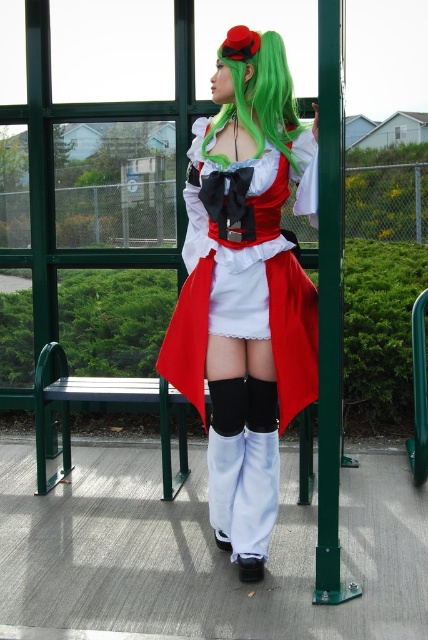
Question: Does satin red coat at center appear on the left side of green silky wig at center?

Choices:
 (A) yes
 (B) no

Answer: (A)

Question: Estimate the real-world distances between objects in this image. Which object is farther from the green silky wig at center?

Choices:
 (A) green metal bench at left
 (B) satin red coat at center

Answer: (A)

Question: Does green metal bench at left have a lesser width compared to green silky wig at center?

Choices:
 (A) yes
 (B) no

Answer: (B)

Question: Which object appears farthest from the camera in this image?

Choices:
 (A) satin red coat at center
 (B) green metal bench at left

Answer: (B)

Question: Among these points, which one is nearest to the camera?

Choices:
 (A) (160, 412)
 (B) (270, 104)

Answer: (B)

Question: Considering the relative positions of satin red coat at center and green silky wig at center in the image provided, where is satin red coat at center located with respect to green silky wig at center?

Choices:
 (A) below
 (B) above

Answer: (A)